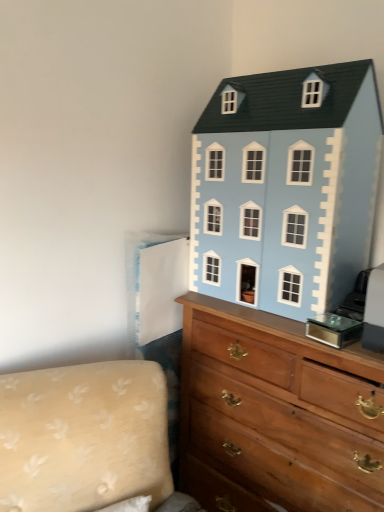
Question: Considering the relative positions of light blue painted wood dollhouse at upper right and beige fabric couch at lower left in the image provided, is light blue painted wood dollhouse at upper right to the left or to the right of beige fabric couch at lower left?

Choices:
 (A) right
 (B) left

Answer: (A)

Question: Is point (324, 128) positioned closer to the camera than point (130, 375)?

Choices:
 (A) closer
 (B) farther

Answer: (B)

Question: Which object is positioned closest to the beige fabric couch at lower left?

Choices:
 (A) light blue painted wood dollhouse at upper right
 (B) wooden chest of drawers at upper right

Answer: (B)

Question: Which object is positioned farthest from the beige fabric couch at lower left?

Choices:
 (A) light blue painted wood dollhouse at upper right
 (B) wooden chest of drawers at upper right

Answer: (A)